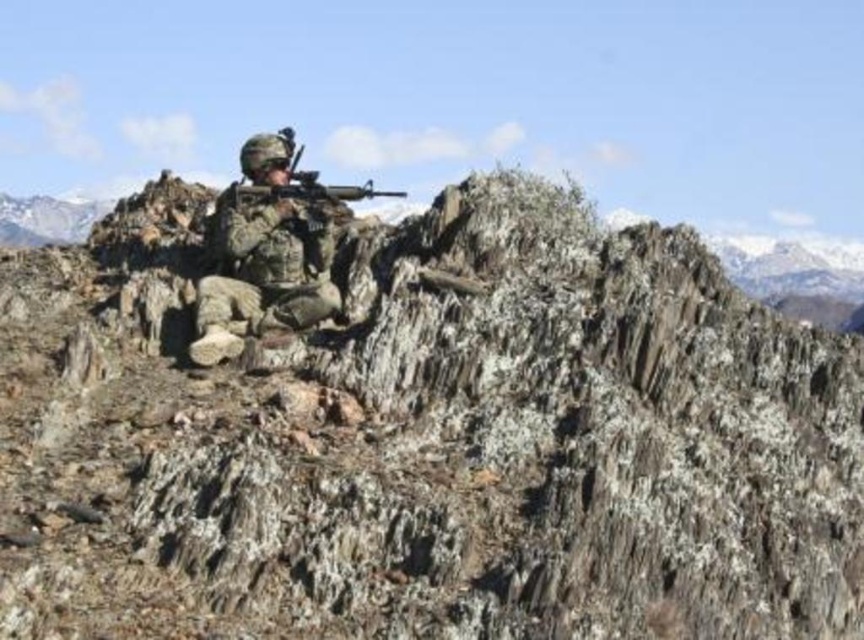
Does camouflage fabric uniform at center have a greater height compared to snowy granite mountain at upper left?

Incorrect, camouflage fabric uniform at center's height is not larger of snowy granite mountain at upper left's.

From the picture: Does camouflage fabric uniform at center appear on the left side of snowy granite mountain at upper left?

In fact, camouflage fabric uniform at center is to the right of snowy granite mountain at upper left.

Between point (293, 225) and point (2, 205), which one is positioned behind?

Point (2, 205)

Locate an element on the screen. The height and width of the screenshot is (640, 864). camouflage fabric uniform at center is located at coordinates (265, 272).

Consider the image. Which is above, camouflage fabric uniform at center or matte black rifle at center?

matte black rifle at center

Can you confirm if camouflage fabric uniform at center is bigger than matte black rifle at center?

Actually, camouflage fabric uniform at center might be smaller than matte black rifle at center.

What do you see at coordinates (265, 272) in the screenshot?
I see `camouflage fabric uniform at center` at bounding box center [265, 272].

Identify the location of camouflage fabric uniform at center. The image size is (864, 640). (265, 272).

Does rocky cliff at center appear on the left side of snowy granite mountain at upper left?

In fact, rocky cliff at center is to the right of snowy granite mountain at upper left.

Is rocky cliff at center behind snowy granite mountain at upper left?

No, it is in front of snowy granite mountain at upper left.

At what (x,y) coordinates should I click in order to perform the action: click on rocky cliff at center. Please return your answer as a coordinate pair (x, y). Looking at the image, I should click on tap(429, 436).